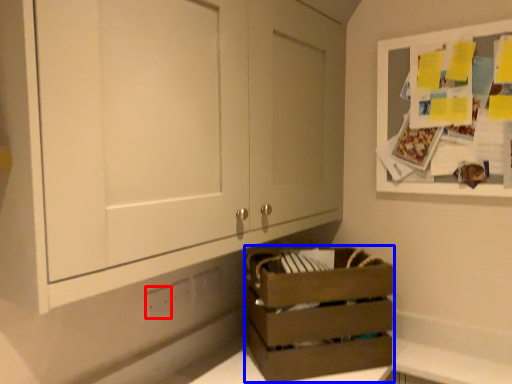
Question: Which of the following is the farthest to the observer, electric outlet (highlighted by a red box) or crate (highlighted by a blue box)?

Choices:
 (A) electric outlet
 (B) crate

Answer: (A)